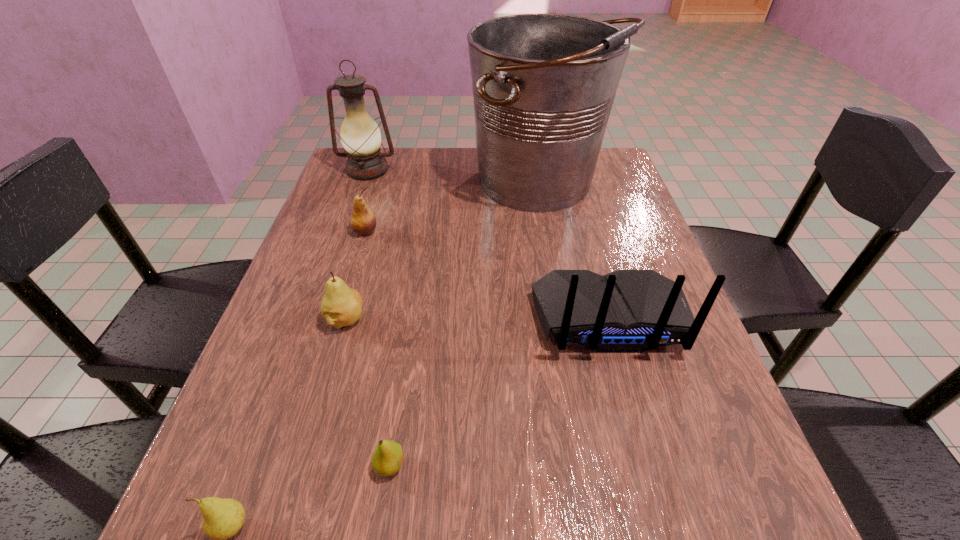
The image size is (960, 540). Find the location of `vacant space located on the back of the farthest pear`. vacant space located on the back of the farthest pear is located at coordinates (390, 152).

What are the coordinates of `vacant region located on the front of the second farthest pear` in the screenshot? It's located at (330, 372).

Where is `free space located 0.200m on the back of the rightmost pear`? The height and width of the screenshot is (540, 960). free space located 0.200m on the back of the rightmost pear is located at coordinates (407, 345).

Locate an element on the screen. This screenshot has width=960, height=540. bucket situated at the far edge is located at coordinates (543, 85).

Find the location of a particular element. This screenshot has width=960, height=540. oil lamp located in the far edge section of the desktop is located at coordinates (360, 136).

Image resolution: width=960 pixels, height=540 pixels. I want to click on oil lamp positioned at the left edge, so click(x=360, y=136).

Where is `bucket positioned at the right edge`? The height and width of the screenshot is (540, 960). bucket positioned at the right edge is located at coordinates (543, 85).

The width and height of the screenshot is (960, 540). What are the coordinates of `router situated at the right edge` in the screenshot? It's located at (626, 311).

Locate an element on the screen. The height and width of the screenshot is (540, 960). object that is at the far left corner is located at coordinates pos(360,136).

Locate an element on the screen. object situated at the far right corner is located at coordinates (543, 85).